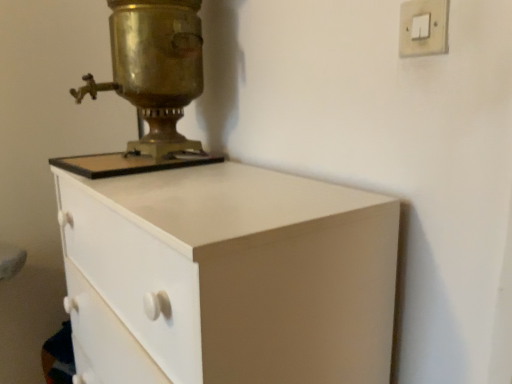
Question: Can you confirm if white matte chest of drawers at center is positioned to the right of brass/bronze metallic samovar at upper left?

Choices:
 (A) no
 (B) yes

Answer: (B)

Question: Is white matte chest of drawers at center bigger than brass/bronze metallic samovar at upper left?

Choices:
 (A) no
 (B) yes

Answer: (B)

Question: Is white matte chest of drawers at center to the left of brass/bronze metallic samovar at upper left from the viewer's perspective?

Choices:
 (A) yes
 (B) no

Answer: (B)

Question: Is brass/bronze metallic samovar at upper left at the back of white matte chest of drawers at center?

Choices:
 (A) yes
 (B) no

Answer: (B)

Question: Is there a large distance between white matte chest of drawers at center and brass/bronze metallic samovar at upper left?

Choices:
 (A) yes
 (B) no

Answer: (B)

Question: Can you confirm if white matte chest of drawers at center is wider than brass/bronze metallic samovar at upper left?

Choices:
 (A) yes
 (B) no

Answer: (A)

Question: From the image's perspective, does white matte chest of drawers at center appear higher than gold metallic light switch at upper right?

Choices:
 (A) no
 (B) yes

Answer: (A)

Question: From the image's perspective, would you say white matte chest of drawers at center is shown under gold metallic light switch at upper right?

Choices:
 (A) yes
 (B) no

Answer: (A)

Question: Is gold metallic light switch at upper right inside white matte chest of drawers at center?

Choices:
 (A) yes
 (B) no

Answer: (B)

Question: Considering the relative positions of white matte chest of drawers at center and gold metallic light switch at upper right in the image provided, is white matte chest of drawers at center in front of gold metallic light switch at upper right?

Choices:
 (A) yes
 (B) no

Answer: (A)

Question: From a real-world perspective, is white matte chest of drawers at center positioned under gold metallic light switch at upper right based on gravity?

Choices:
 (A) no
 (B) yes

Answer: (B)

Question: Can you confirm if white matte chest of drawers at center is positioned to the right of gold metallic light switch at upper right?

Choices:
 (A) yes
 (B) no

Answer: (B)

Question: Does gold metallic light switch at upper right lie in front of white matte chest of drawers at center?

Choices:
 (A) no
 (B) yes

Answer: (A)